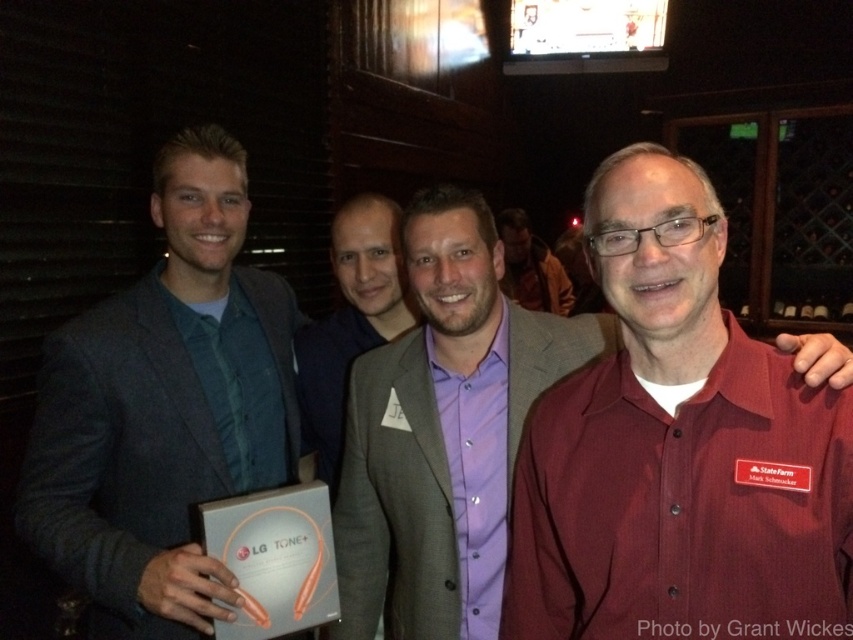
Question: Which object is closer to the camera taking this photo?

Choices:
 (A) purple satin shirt at center
 (B) maroon button-down shirt at center
 (C) purple fabric shirt at center

Answer: (B)

Question: Can you confirm if maroon button-down shirt at center is positioned to the left of purple fabric shirt at center?

Choices:
 (A) yes
 (B) no

Answer: (B)

Question: Does maroon button-down shirt at center appear on the left side of purple satin shirt at center?

Choices:
 (A) yes
 (B) no

Answer: (A)

Question: Which of these objects is positioned closest to the maroon button-down shirt at center?

Choices:
 (A) purple fabric shirt at center
 (B) matte gray suit at left

Answer: (B)

Question: Does matte gray suit at left have a smaller size compared to maroon button-down shirt at center?

Choices:
 (A) no
 (B) yes

Answer: (A)

Question: Which point is closer to the camera?

Choices:
 (A) purple fabric shirt at center
 (B) purple satin shirt at center
 (C) matte gray suit at left

Answer: (C)